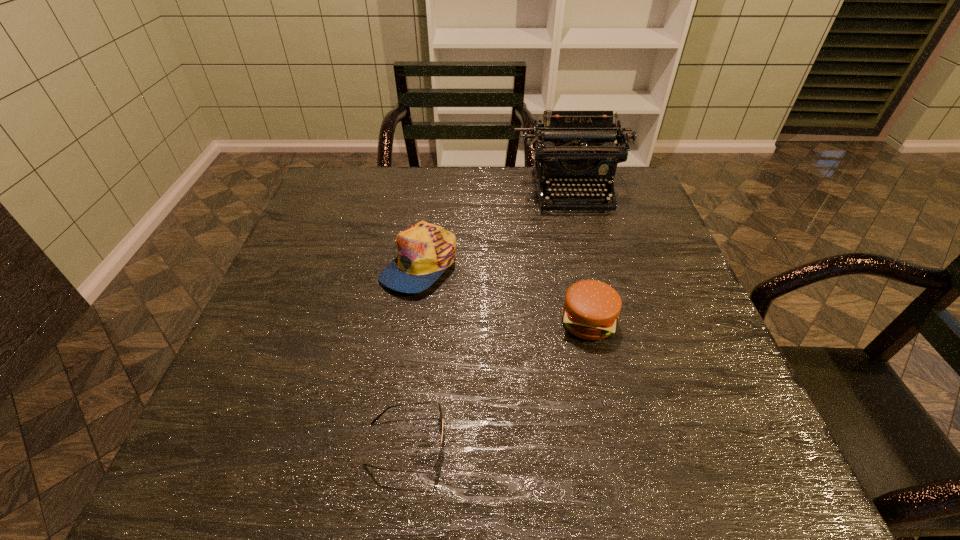
The width and height of the screenshot is (960, 540). I want to click on vacant space situated 0.340m on the left of the second nearest object, so click(398, 322).

Identify the location of vacant space situated on the front-facing side of the nearest object. (522, 444).

Find the location of a particular element. object that is at the far edge is located at coordinates (570, 147).

Find the location of a particular element. This screenshot has height=540, width=960. object situated at the near edge is located at coordinates pos(438,461).

Image resolution: width=960 pixels, height=540 pixels. I want to click on object located in the right edge section of the desktop, so click(x=570, y=147).

This screenshot has width=960, height=540. In order to click on object situated at the far right corner in this screenshot , I will do `click(570, 147)`.

Locate an element on the screen. Image resolution: width=960 pixels, height=540 pixels. vacant space at the far edge of the desktop is located at coordinates (396, 167).

The width and height of the screenshot is (960, 540). Find the location of `blank space at the near edge`. blank space at the near edge is located at coordinates (432, 462).

I want to click on vacant space at the left edge of the desktop, so click(321, 309).

At what (x,y) coordinates should I click in order to perform the action: click on vacant area at the right edge of the desktop. Please return your answer as a coordinate pair (x, y). Looking at the image, I should click on (642, 257).